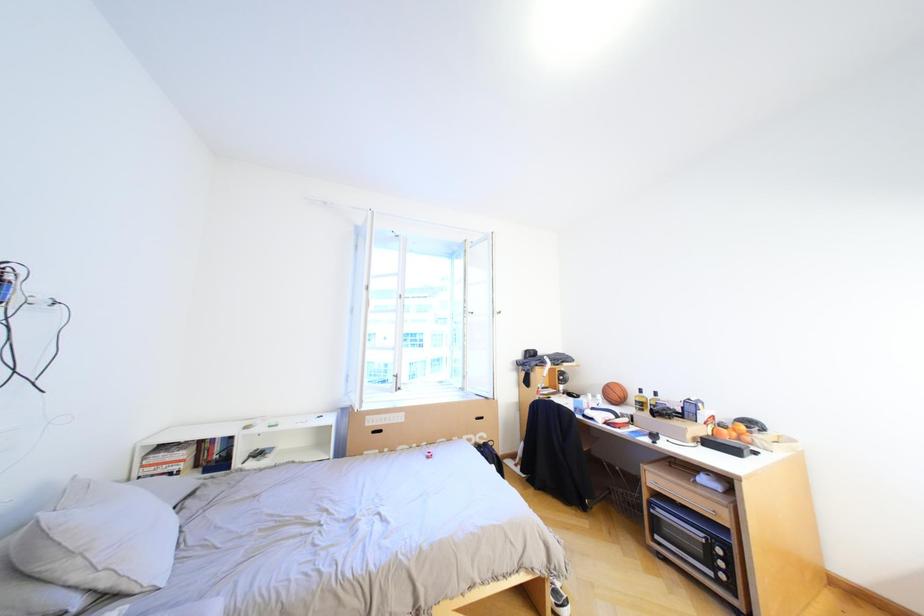
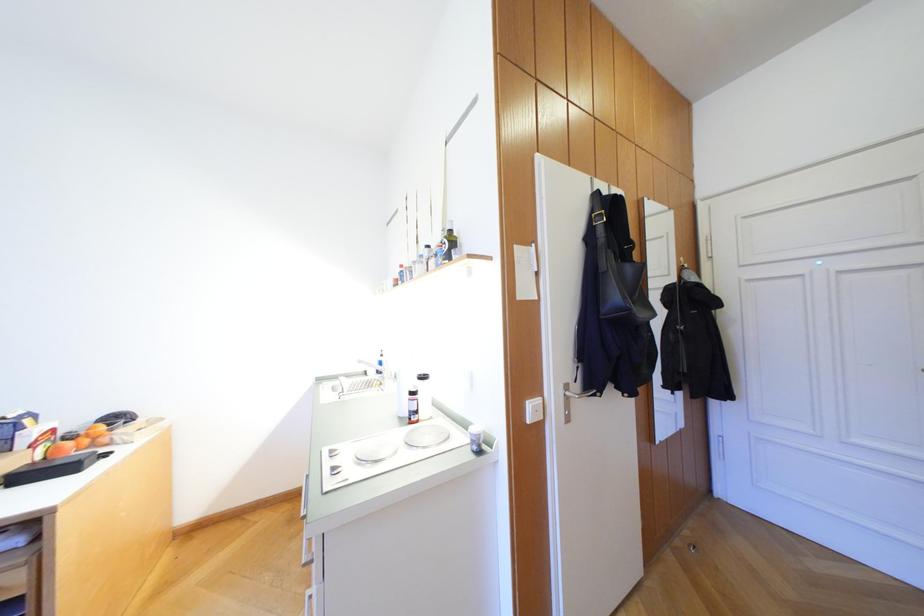
Question: How did the camera likely rotate?

Choices:
 (A) Left
 (B) Right
 (C) Up
 (D) Down

Answer: (B)